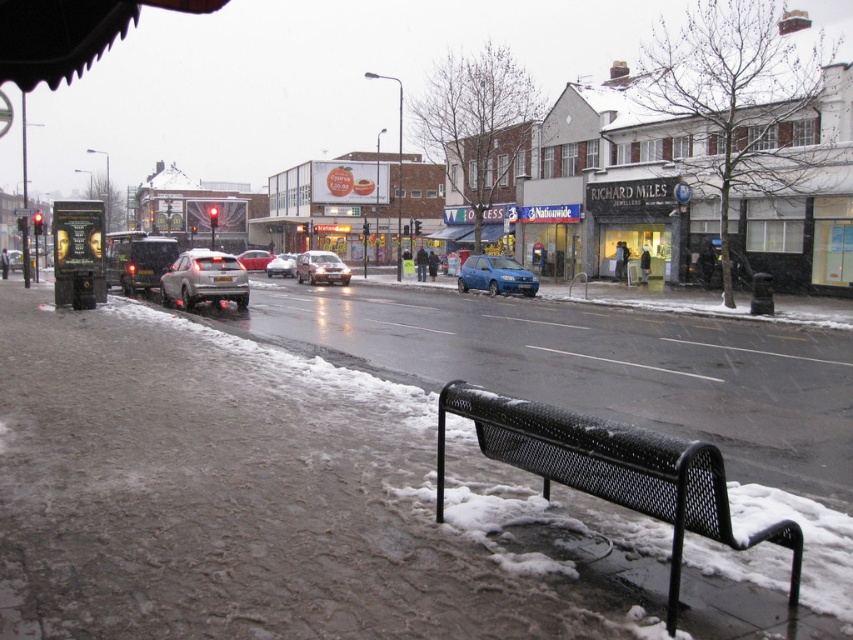
Is point (303, 280) closer to viewer compared to point (251, 266)?

Yes, point (303, 280) is in front of point (251, 266).

The image size is (853, 640). Describe the element at coordinates (321, 268) in the screenshot. I see `satin silver sedan at center` at that location.

Is point (299, 278) positioned after point (248, 262)?

No.

Identify the location of satin silver sedan at center. The image size is (853, 640). (321, 268).

Does metallic gray bench at lower center have a larger size compared to white glossy car at center?

No, metallic gray bench at lower center is not bigger than white glossy car at center.

Measure the distance between metallic gray bench at lower center and camera.

metallic gray bench at lower center and camera are 3.53 meters apart.

Image resolution: width=853 pixels, height=640 pixels. What do you see at coordinates (270, 496) in the screenshot?
I see `metallic gray bench at lower center` at bounding box center [270, 496].

The height and width of the screenshot is (640, 853). I want to click on metallic gray bench at lower center, so click(x=270, y=496).

Is point (666, 576) positioned behind point (293, 273)?

No, it is in front of (293, 273).

Does metallic gray bench at lower center appear on the right side of silver metallic sedan at center?

Indeed, metallic gray bench at lower center is positioned on the right side of silver metallic sedan at center.

Where is `metallic gray bench at lower center`? metallic gray bench at lower center is located at coordinates (270, 496).